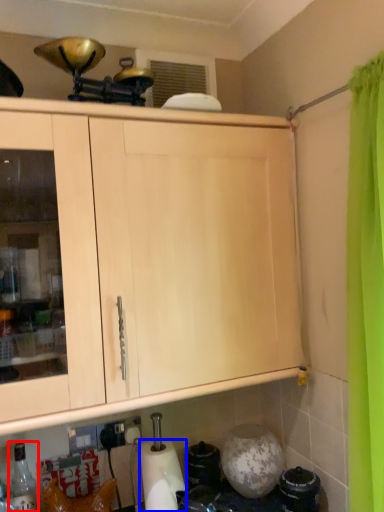
Question: Among these objects, which one is farthest to the camera, bottle (highlighted by a red box) or paper towel (highlighted by a blue box)?

Choices:
 (A) bottle
 (B) paper towel

Answer: (B)